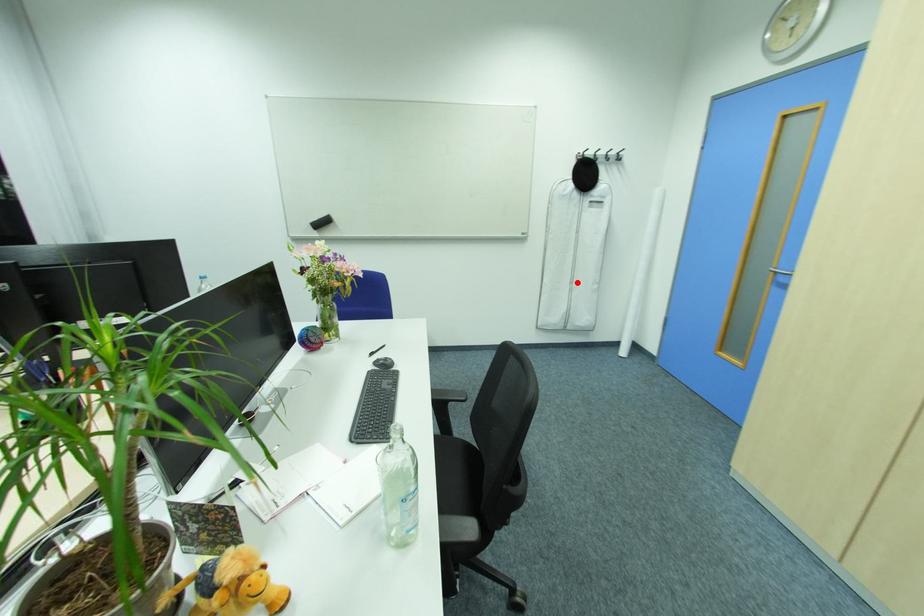
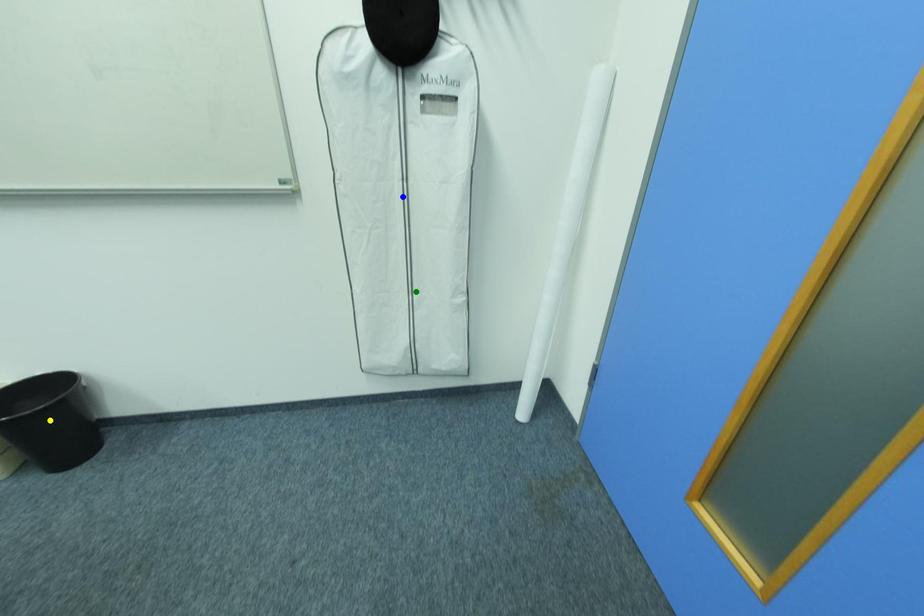
Question: I am providing you with two images of the same scene from different viewpoints. A red point is marked on the first image. You are given multiple points on the second image. Which point in image 2 is actually the same real-world point as the red point in image 1?

Choices:
 (A) yellow point
 (B) blue point
 (C) green point

Answer: (C)